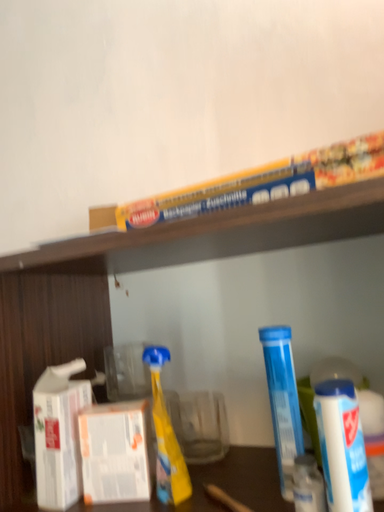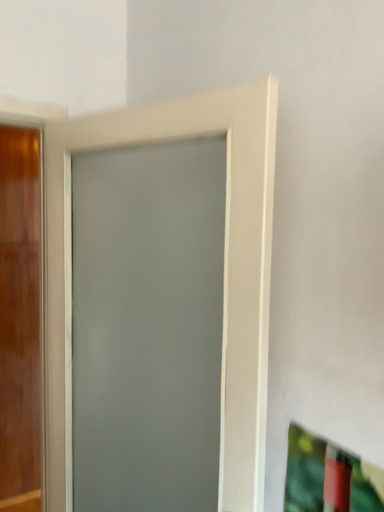
Question: How did the camera likely rotate when shooting the video?

Choices:
 (A) rotated upward
 (B) rotated downward

Answer: (B)